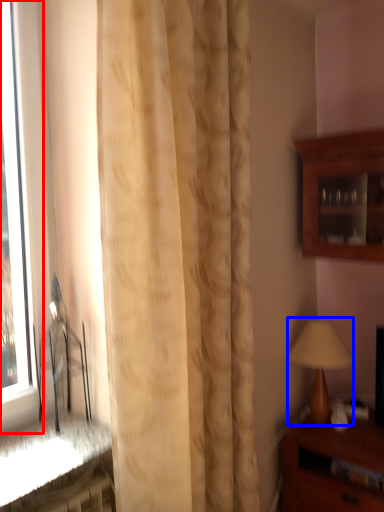
Question: Which point is closer to the camera, window (highlighted by a red box) or table lamp (highlighted by a blue box)?

Choices:
 (A) window
 (B) table lamp

Answer: (A)